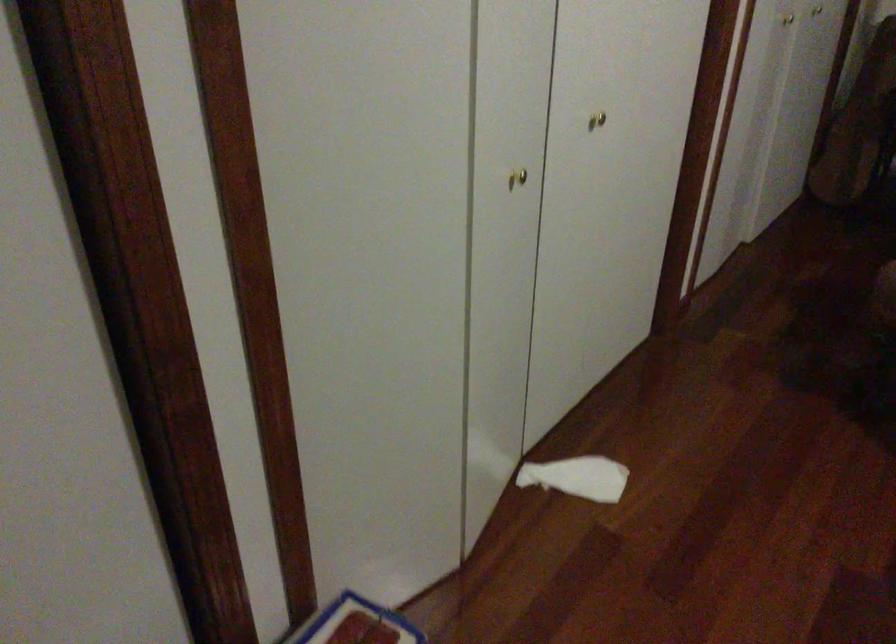
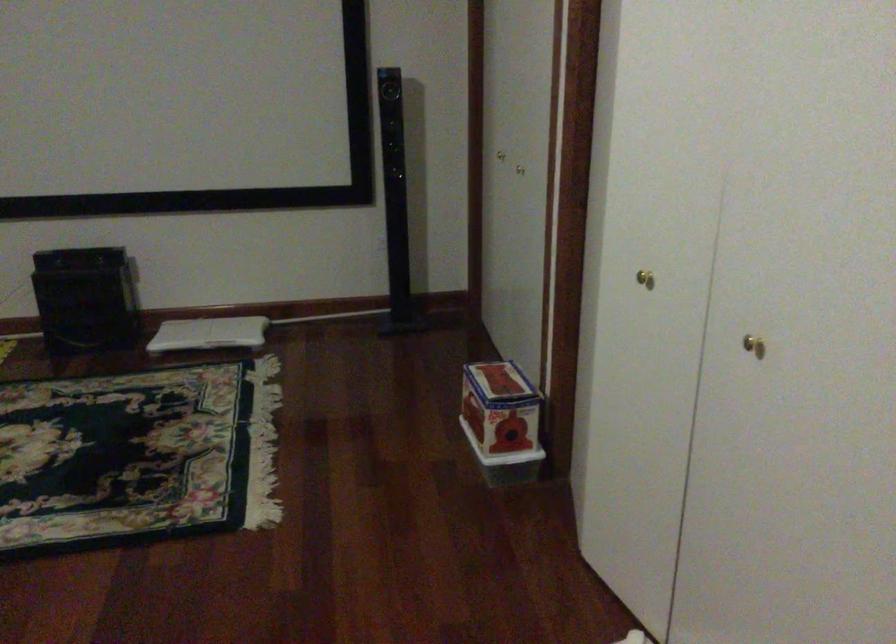
Where in the second image is the point corresponding to point 514,174 from the first image?

(644, 279)